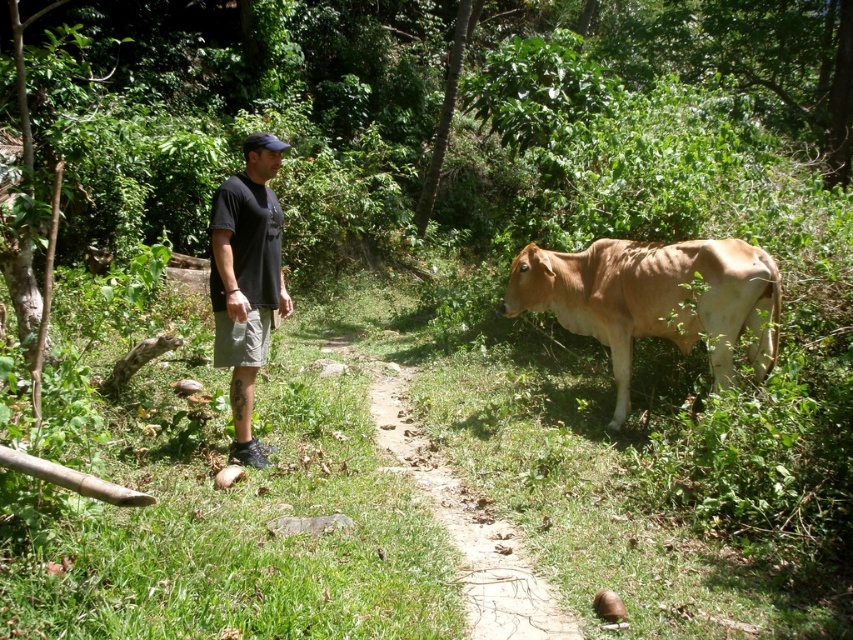
From the picture: You are standing on the green grassy trail at center and want to approach the brown smooth cow at right. Which direction should you move to reach it?

The brown smooth cow at right is to the right of the green grassy trail at center, so you should move to the right to reach it.